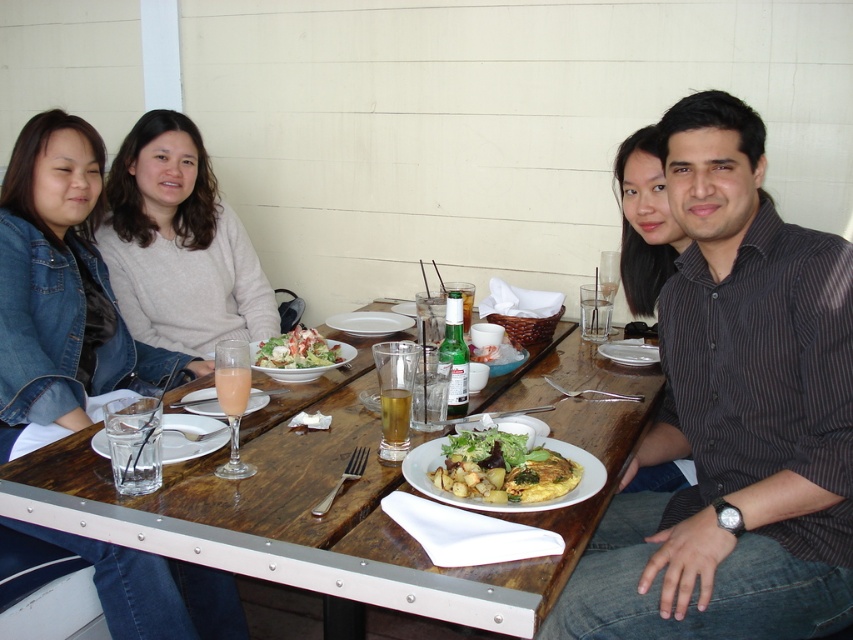
Question: Which point appears closest to the camera in this image?

Choices:
 (A) (128, 628)
 (B) (218, 371)
 (C) (241, 262)
 (D) (616, 358)

Answer: (B)

Question: Which of the following is the farthest from the observer?

Choices:
 (A) (758, 220)
 (B) (669, 483)
 (C) (151, 170)

Answer: (C)

Question: Is salad with croutons and dressing at center positioned in front of white ceramic plate at center?

Choices:
 (A) yes
 (B) no

Answer: (A)

Question: Does wooden table at center appear on the right side of clear glass plate at lower left?

Choices:
 (A) yes
 (B) no

Answer: (A)

Question: Is salad with croutons and dressing at center thinner than white ceramic plate at center?

Choices:
 (A) no
 (B) yes

Answer: (B)

Question: Among these objects, which one is nearest to the camera?

Choices:
 (A) white matte plate at center
 (B) wooden table at center
 (C) black striped shirt at right

Answer: (B)